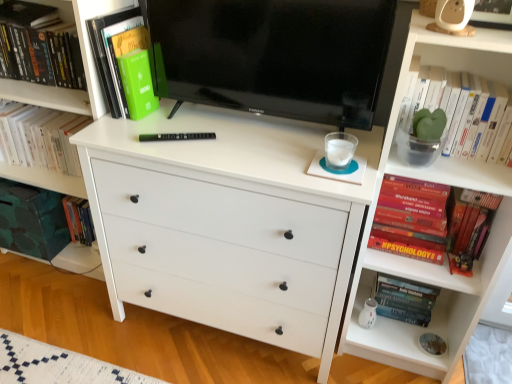
Find the location of a particular element. The width and height of the screenshot is (512, 384). vacant space that's between green matte book at upper left, positioned as the 2th book in left-to-right order, and black glossy tv at center is located at coordinates (212, 132).